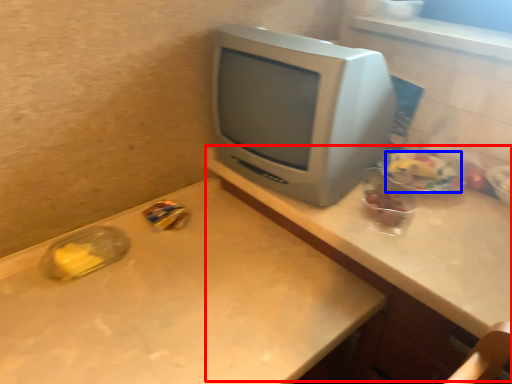
Question: Which of the following is the closest to the observer, computer desk (highlighted by a red box) or food (highlighted by a blue box)?

Choices:
 (A) computer desk
 (B) food

Answer: (A)